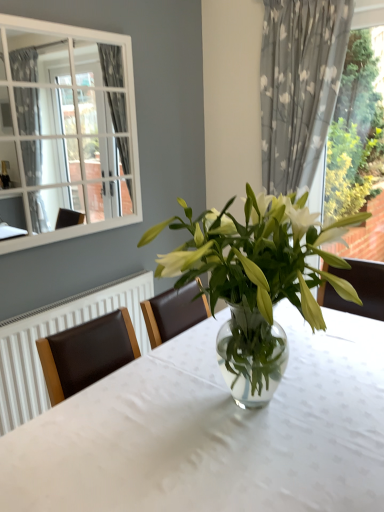
Image resolution: width=384 pixels, height=512 pixels. I want to click on vacant space underneath clear glass vase at center (from a real-world perspective), so click(261, 412).